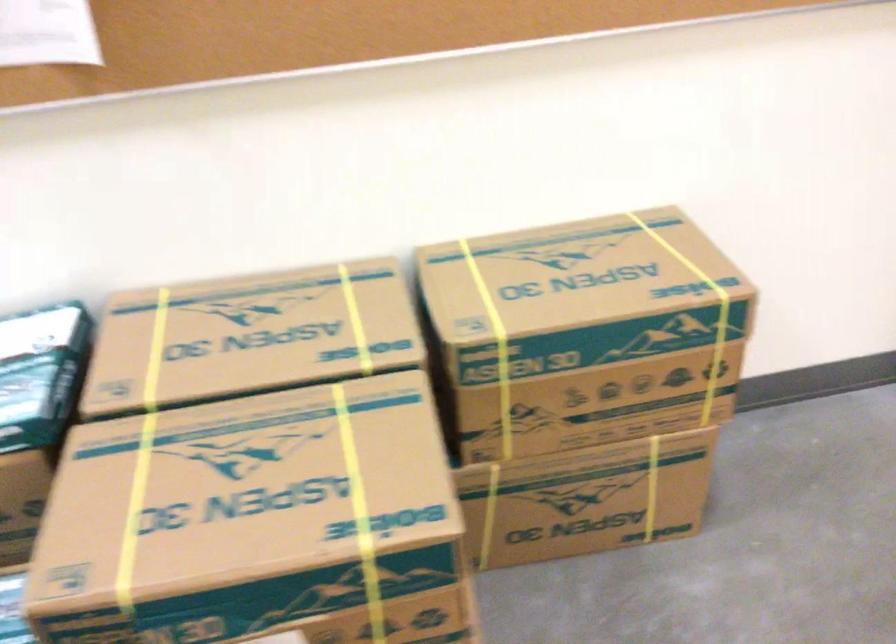
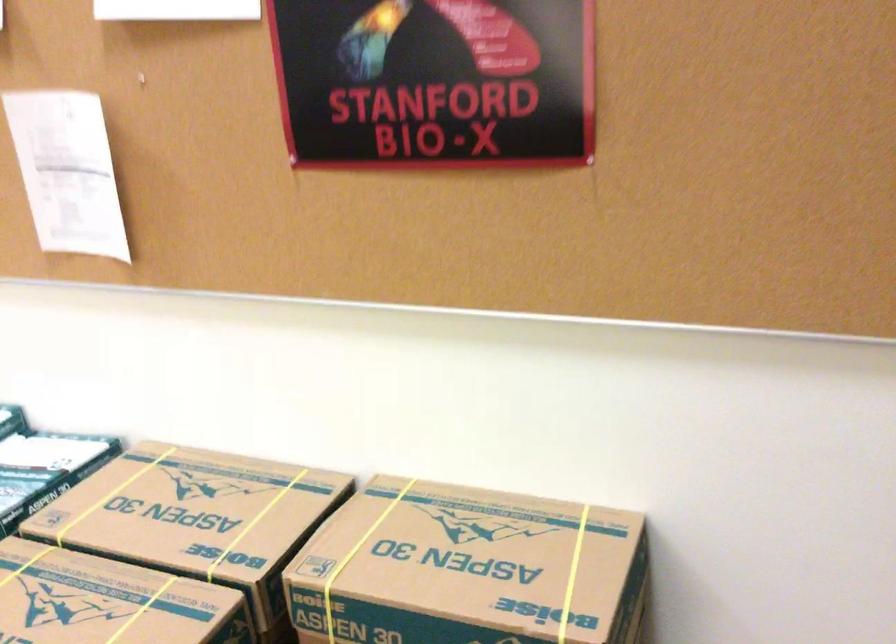
Find the pixel in the second image that matches [497,308] in the first image.

(357, 556)